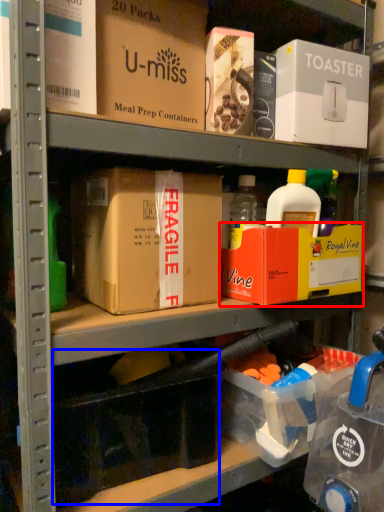
Question: Which point is closer to the camera, box (highlighted by a red box) or storage box (highlighted by a blue box)?

Choices:
 (A) box
 (B) storage box

Answer: (B)